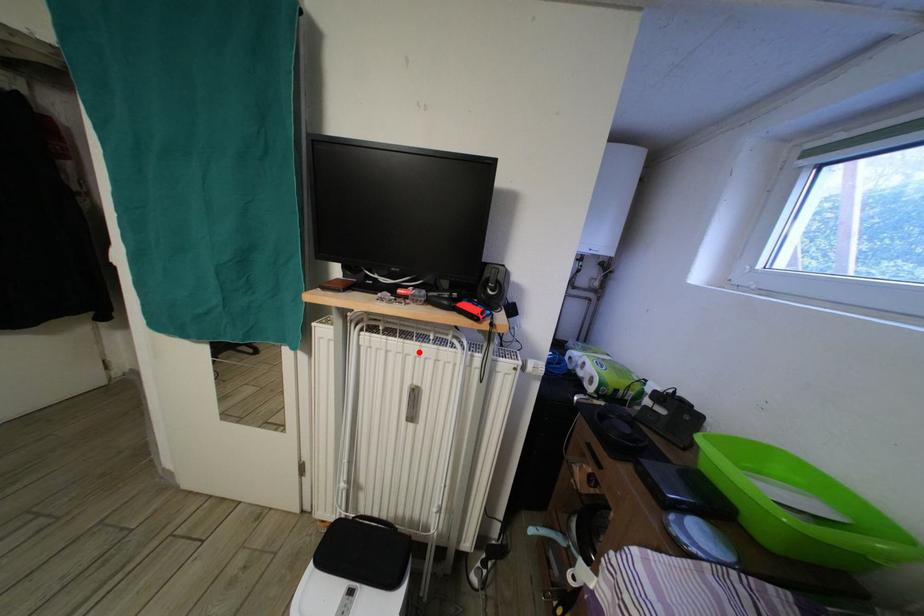
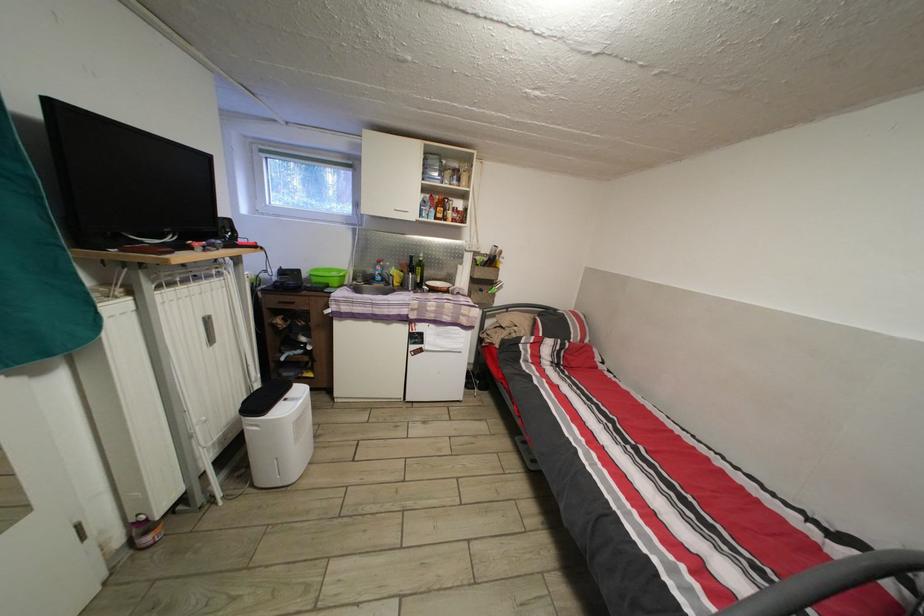
Find the pixel in the second image that matches the highlighted location in the first image.

(201, 294)